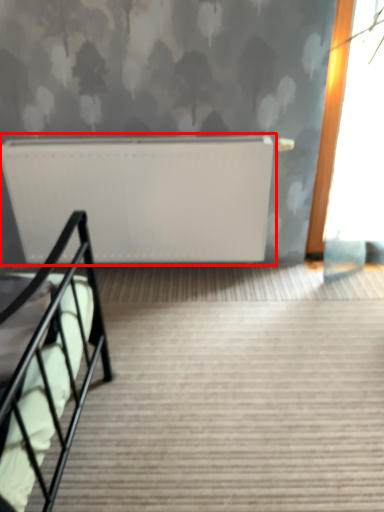
Question: Observing the image, what is the correct spatial positioning of radiator (annotated by the red box) in reference to stairs?

Choices:
 (A) right
 (B) left

Answer: (B)